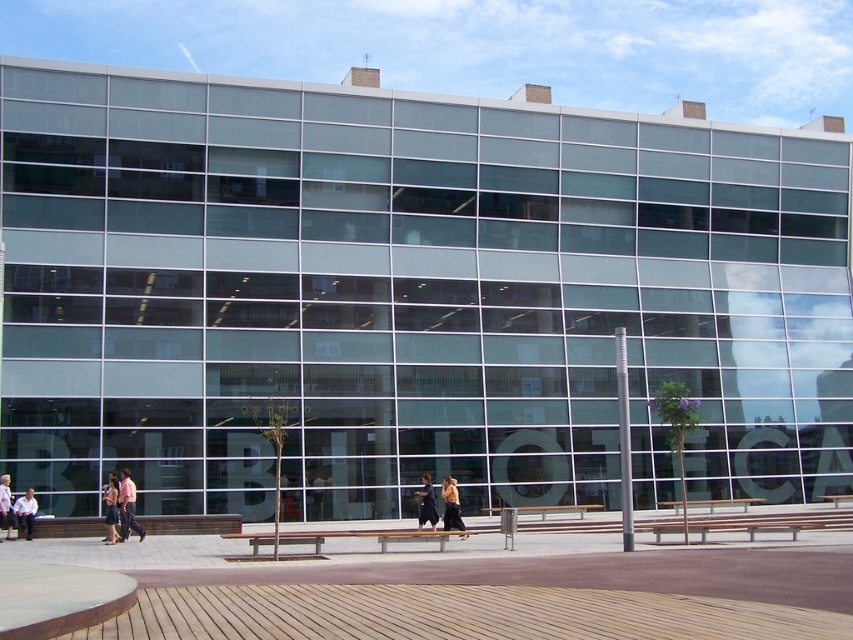
Question: Which point is farther to the camera?

Choices:
 (A) (32, 536)
 (B) (115, 481)
 (C) (418, 532)
 (D) (485, 508)

Answer: (D)

Question: Estimate the real-world distances between objects in this image. Which object is closer to the pink fabric shirt at center?

Choices:
 (A) brown wooden bench at center
 (B) black fabric dress at center

Answer: (A)

Question: Estimate the real-world distances between objects in this image. Which object is farther from the transparent glass benches at center?

Choices:
 (A) wooden bench at center
 (B) brown wooden bench at center
 (C) dark blue jeans at center

Answer: (B)

Question: Is brown wooden bench at center bigger than light blue shirt at lower left?

Choices:
 (A) yes
 (B) no

Answer: (B)

Question: Is pink fabric shirt at center thinner than light purple fabric dress at center?

Choices:
 (A) yes
 (B) no

Answer: (B)

Question: Does brown wooden bench at center appear under pink fabric shirt at center?

Choices:
 (A) yes
 (B) no

Answer: (A)